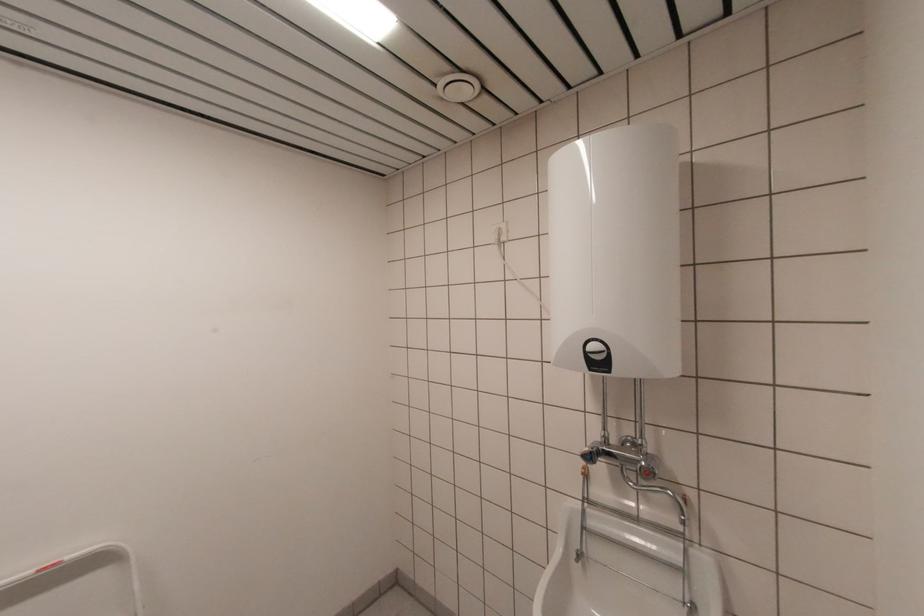
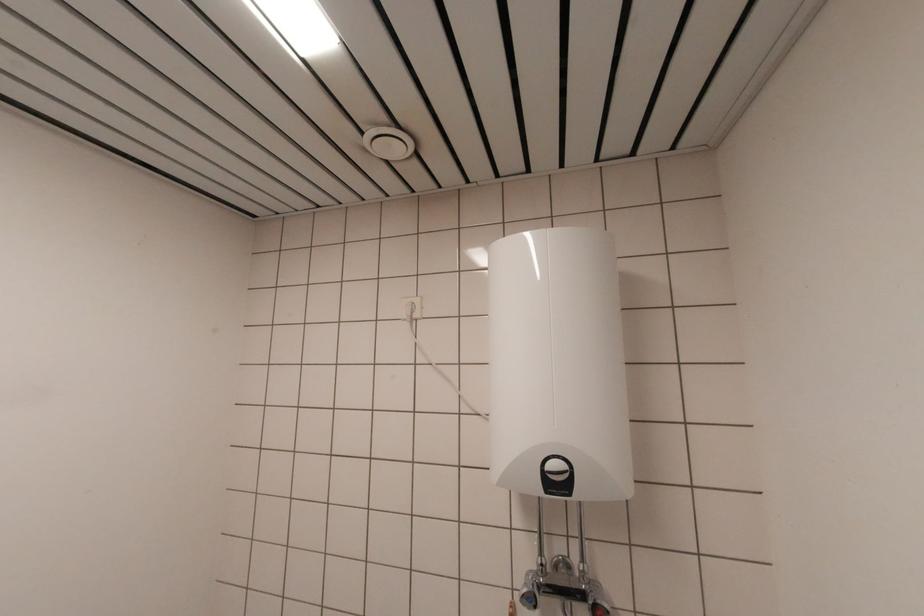
Question: The camera is either moving clockwise (left) or counter-clockwise (right) around the object. The first image is from the beginning of the video and the second image is from the end. Is the camera moving left or right when shooting the video?

Choices:
 (A) Left
 (B) Right

Answer: (A)